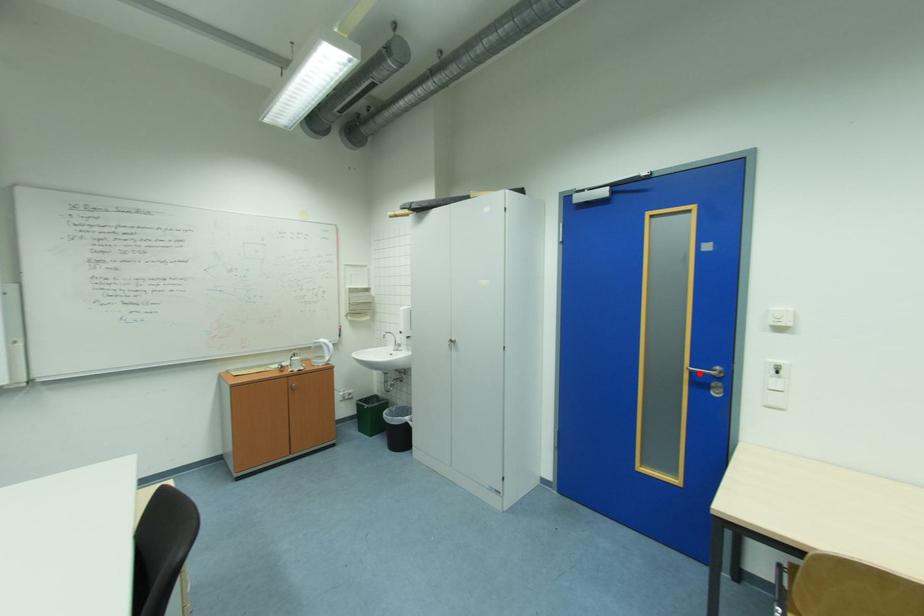
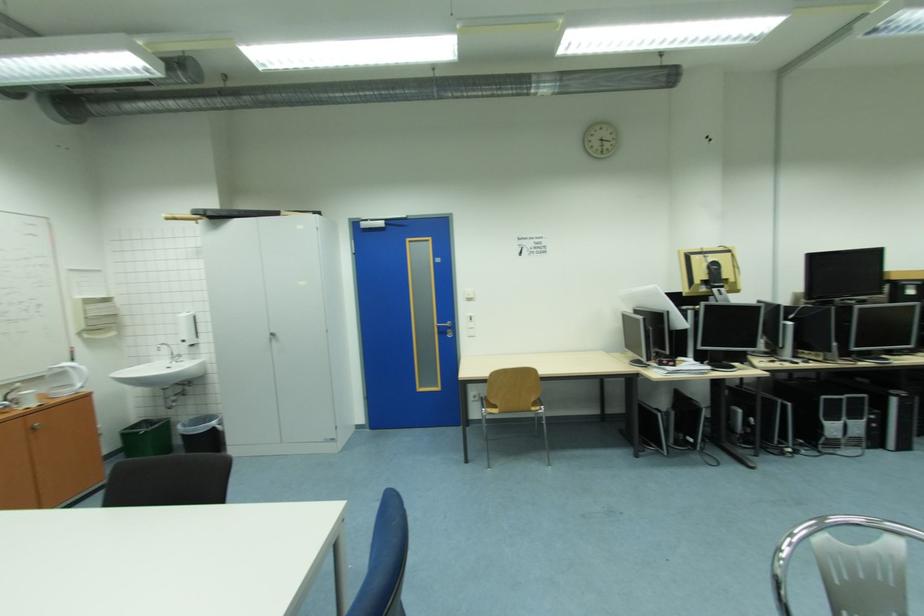
Where in the second image is the point corresponding to the highlighted location from the first image?

(445, 328)